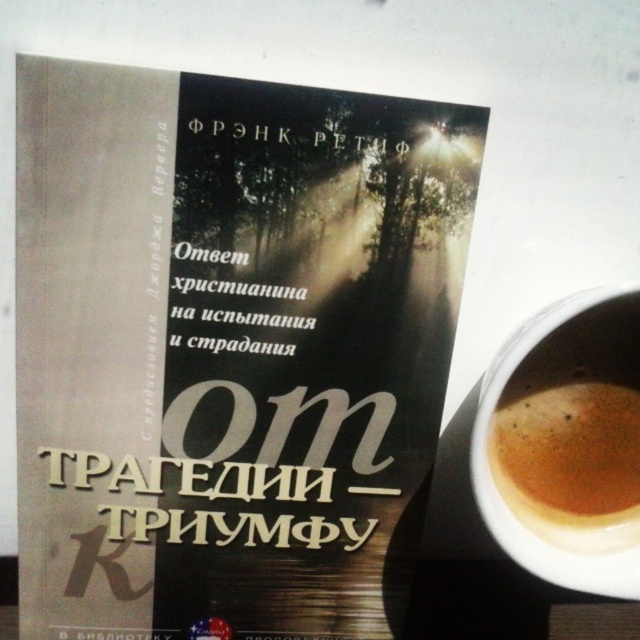
Question: Which point appears farthest from the camera in this image?

Choices:
 (A) (241, 180)
 (B) (515, 540)

Answer: (B)

Question: From the image, what is the correct spatial relationship of brown frothy coffee at lower right in relation to brown frothy coffee at right?

Choices:
 (A) below
 (B) above

Answer: (A)

Question: Based on their relative distances, which object is nearer to the brown frothy coffee at right?

Choices:
 (A) matte paper book at center
 (B) brown frothy coffee at lower right

Answer: (B)

Question: Is matte paper book at center to the right of brown frothy coffee at right from the viewer's perspective?

Choices:
 (A) yes
 (B) no

Answer: (B)

Question: Which of the following is the closest to the observer?

Choices:
 (A) (545, 333)
 (B) (115, 67)
 (C) (509, 410)

Answer: (B)

Question: Where is matte paper book at center located in relation to brown frothy coffee at lower right in the image?

Choices:
 (A) below
 (B) above

Answer: (B)